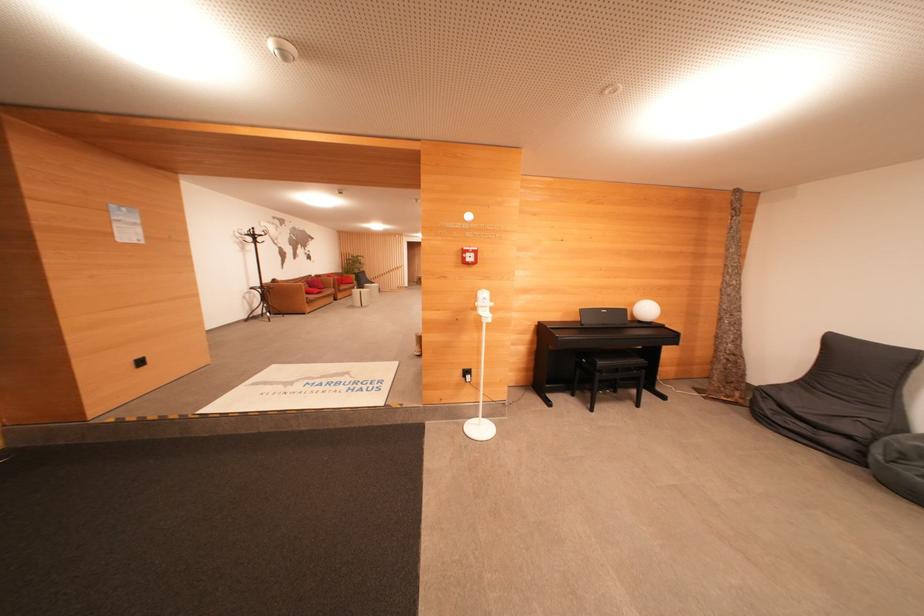
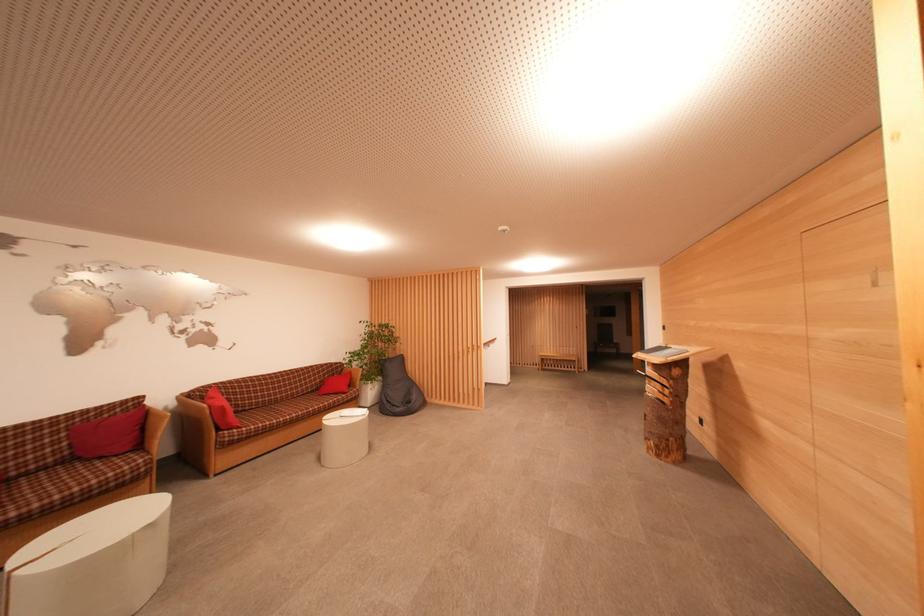
The point at (366, 274) is marked in the first image. Where is the corresponding point in the second image?

(402, 357)